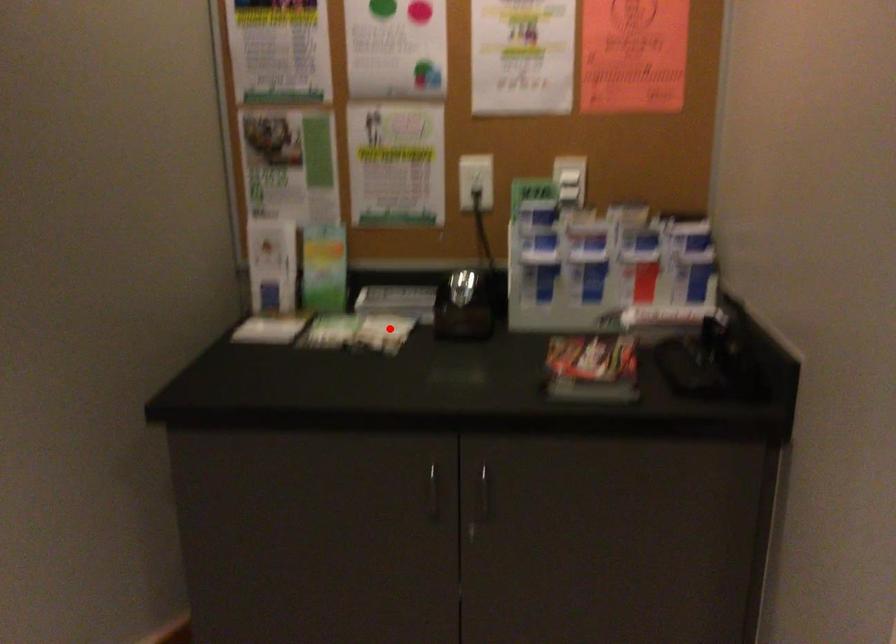
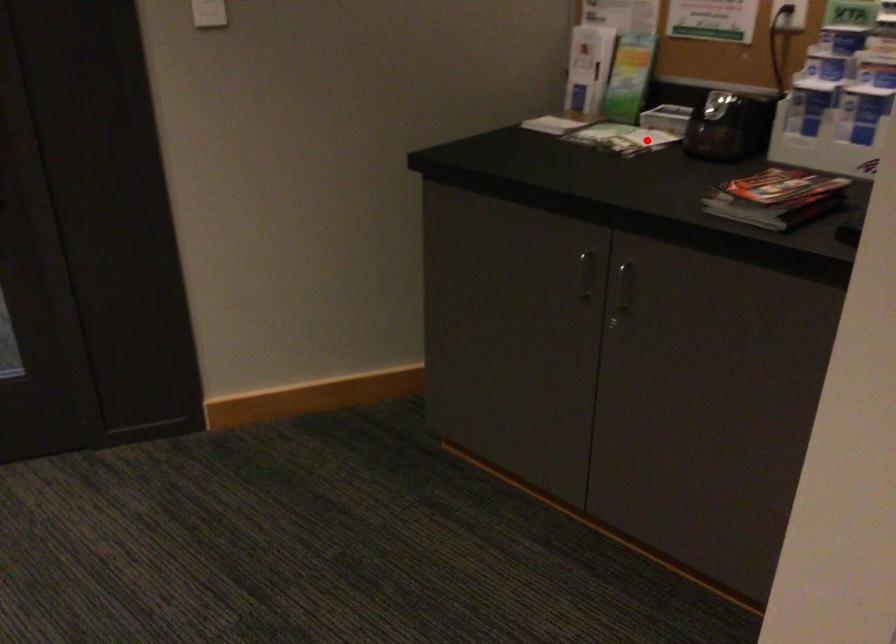
I am providing you with two images of the same scene from different viewpoints. A red point is marked on the first image and another point is marked on the second image. Is the red point in image1 aligned with the point shown in image2?

Yes